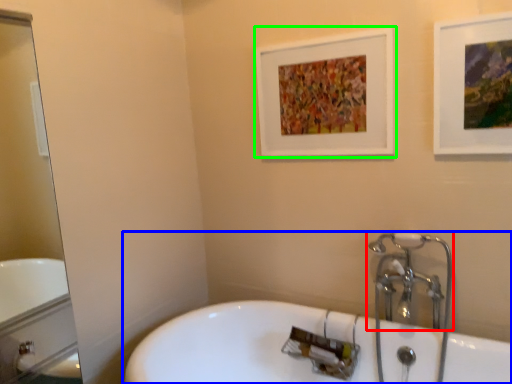
Question: Based on their relative distances, which object is farther from tap (highlighted by a red box)? Choose from bathtub (highlighted by a blue box) and picture frame (highlighted by a green box).

Choices:
 (A) bathtub
 (B) picture frame

Answer: (B)